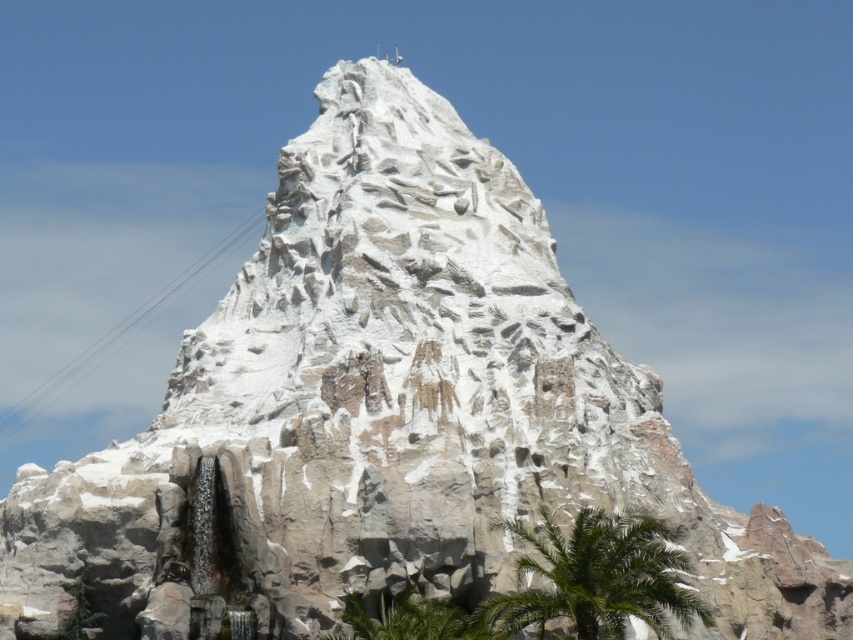
Question: Can you confirm if green leafy palm tree at lower right is bigger than green leafy palm tree at lower center?

Choices:
 (A) no
 (B) yes

Answer: (B)

Question: Which point is closer to the camera?

Choices:
 (A) (354, 625)
 (B) (537, 602)

Answer: (B)

Question: Can you confirm if green leafy palm tree at lower right is wider than green leafy palm tree at lower center?

Choices:
 (A) yes
 (B) no

Answer: (A)

Question: Is green leafy palm tree at lower right to the left of green leafy palm tree at lower center from the viewer's perspective?

Choices:
 (A) no
 (B) yes

Answer: (A)

Question: Which of the following is the farthest from the observer?

Choices:
 (A) green leafy palm tree at lower center
 (B) green leafy palm tree at lower right

Answer: (A)